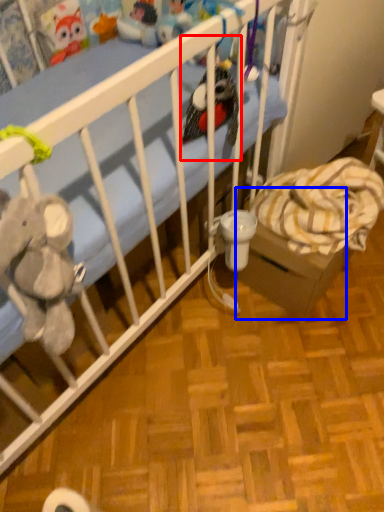
Question: Which object appears closest to the camera in this image, toy (highlighted by a red box) or cardboard box (highlighted by a blue box)?

Choices:
 (A) toy
 (B) cardboard box

Answer: (A)